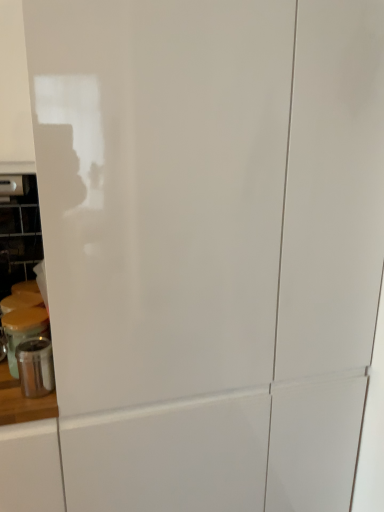
Question: Is metallic silver canister at left, positioned as the second appliance in back-to-front order, turned away from metallic silver canister at lower left, placed as the first appliance when sorted from back to front?

Choices:
 (A) no
 (B) yes

Answer: (B)

Question: Can you confirm if metallic silver canister at left, placed as the 1th appliance when sorted from front to back, is taller than metallic silver canister at lower left, placed as the first appliance when sorted from back to front?

Choices:
 (A) no
 (B) yes

Answer: (A)

Question: From a real-world perspective, is metallic silver canister at left, positioned as the second appliance in back-to-front order, under metallic silver canister at lower left, acting as the second appliance starting from the front?

Choices:
 (A) no
 (B) yes

Answer: (B)

Question: Is metallic silver canister at left, placed as the 1th appliance when sorted from front to back, to the right of metallic silver canister at lower left, placed as the first appliance when sorted from back to front, from the viewer's perspective?

Choices:
 (A) no
 (B) yes

Answer: (B)

Question: Is metallic silver canister at left, placed as the 1th appliance when sorted from front to back, positioned behind metallic silver canister at lower left, acting as the second appliance starting from the front?

Choices:
 (A) no
 (B) yes

Answer: (A)

Question: Is metallic silver canister at left, positioned as the second appliance in back-to-front order, facing towards metallic silver canister at lower left, acting as the second appliance starting from the front?

Choices:
 (A) yes
 (B) no

Answer: (B)

Question: From the image's perspective, is metallic silver canister at lower left, acting as the second appliance starting from the front, located beneath metallic silver canister at left, positioned as the second appliance in back-to-front order?

Choices:
 (A) no
 (B) yes

Answer: (A)

Question: From the image's perspective, would you say metallic silver canister at lower left, acting as the second appliance starting from the front, is positioned over metallic silver canister at left, placed as the 1th appliance when sorted from front to back?

Choices:
 (A) no
 (B) yes

Answer: (B)

Question: Is metallic silver canister at lower left, placed as the first appliance when sorted from back to front, bigger than metallic silver canister at left, positioned as the second appliance in back-to-front order?

Choices:
 (A) no
 (B) yes

Answer: (B)

Question: From a real-world perspective, is metallic silver canister at lower left, acting as the second appliance starting from the front, beneath metallic silver canister at left, placed as the 1th appliance when sorted from front to back?

Choices:
 (A) no
 (B) yes

Answer: (A)

Question: Is the position of metallic silver canister at lower left, acting as the second appliance starting from the front, less distant than that of metallic silver canister at left, placed as the 1th appliance when sorted from front to back?

Choices:
 (A) no
 (B) yes

Answer: (A)

Question: Can you confirm if metallic silver canister at lower left, placed as the first appliance when sorted from back to front, is wider than metallic silver canister at left, positioned as the second appliance in back-to-front order?

Choices:
 (A) no
 (B) yes

Answer: (B)

Question: Visually, is metallic silver canister at left, placed as the 1th appliance when sorted from front to back, positioned to the left or to the right of metallic silver canister at lower left, acting as the second appliance starting from the front?

Choices:
 (A) left
 (B) right

Answer: (B)